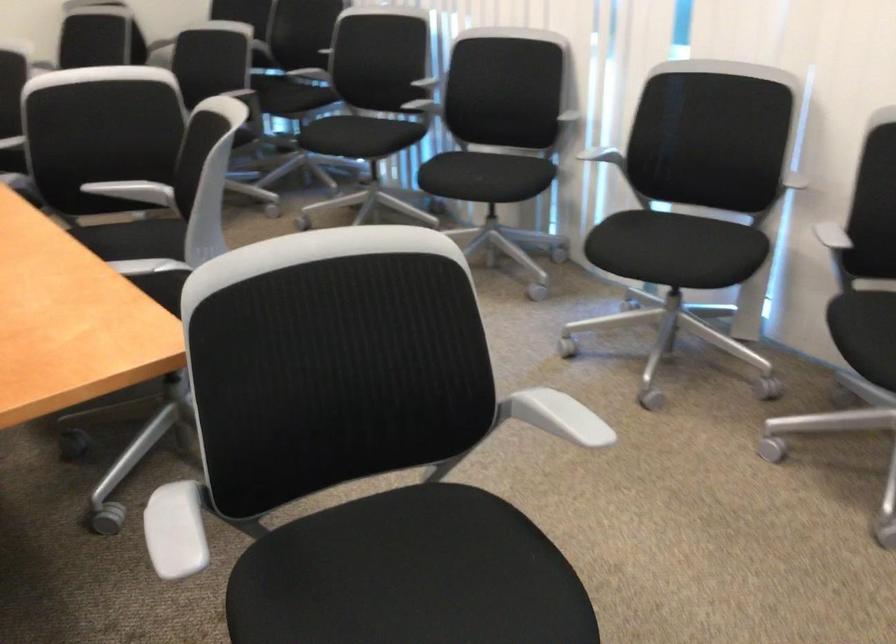
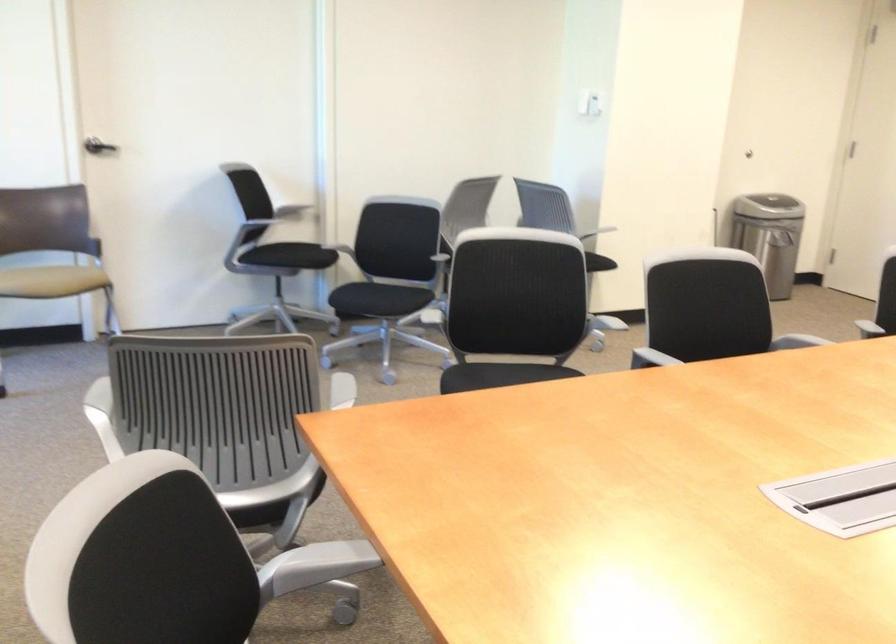
Find the pixel in the second image that matches point 95,266 in the first image.

(320, 562)